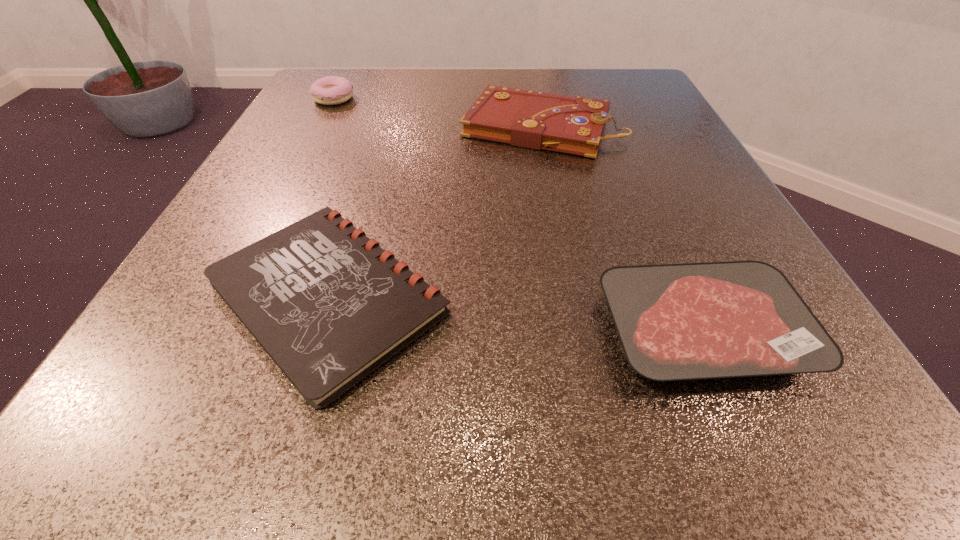
Where is `vacant space at the far edge`? This screenshot has height=540, width=960. vacant space at the far edge is located at coordinates (523, 69).

I want to click on vacant space at the near edge of the desktop, so click(x=296, y=392).

At what (x,y) coordinates should I click in order to perform the action: click on vacant area at the left edge. Please return your answer as a coordinate pair (x, y). Looking at the image, I should click on [x=342, y=172].

In the image, there is a desktop. Identify the location of free region at the right edge. (663, 168).

This screenshot has height=540, width=960. What are the coordinates of `free space at the far left corner of the desktop` in the screenshot? It's located at (310, 97).

In the image, there is a desktop. In order to click on vacant region at the near left corner in this screenshot , I will do `click(111, 434)`.

Where is `vacant space at the far right corner of the desktop`? The width and height of the screenshot is (960, 540). vacant space at the far right corner of the desktop is located at coordinates (641, 79).

Where is `vacant region at the near right corner of the desktop`? The image size is (960, 540). vacant region at the near right corner of the desktop is located at coordinates (761, 404).

This screenshot has height=540, width=960. What are the coordinates of `free space between the steak and the taller notebook` in the screenshot? It's located at (622, 228).

Locate an element on the screen. unoccupied area between the nearer notebook and the farther notebook is located at coordinates 435,211.